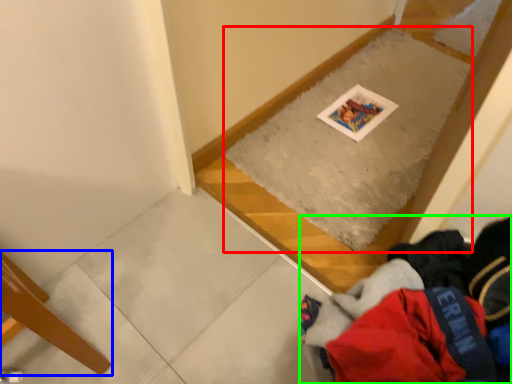
Question: Considering the real-world distances, which object is farthest from mat (highlighted by a red box)? furniture (highlighted by a blue box) or clothing (highlighted by a green box)?

Choices:
 (A) furniture
 (B) clothing

Answer: (A)